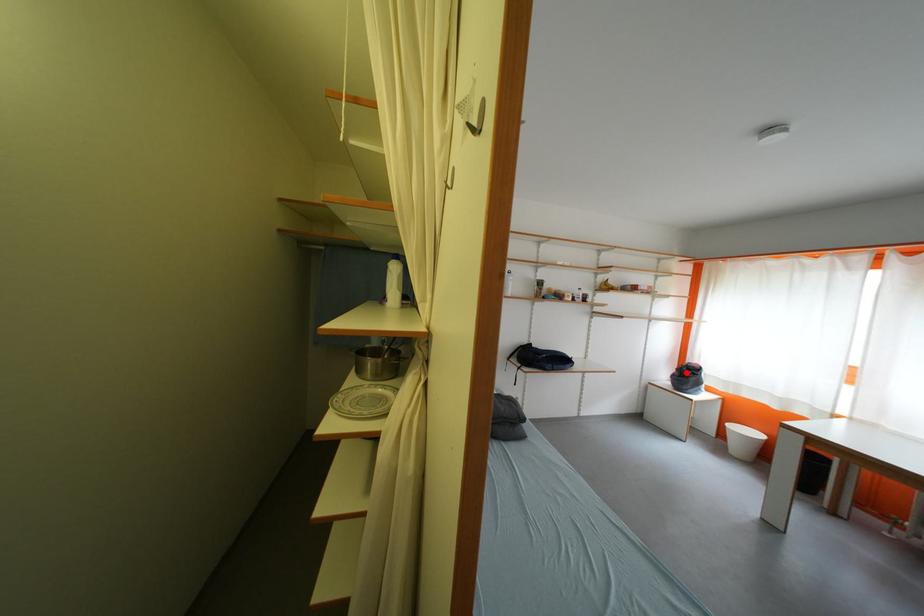
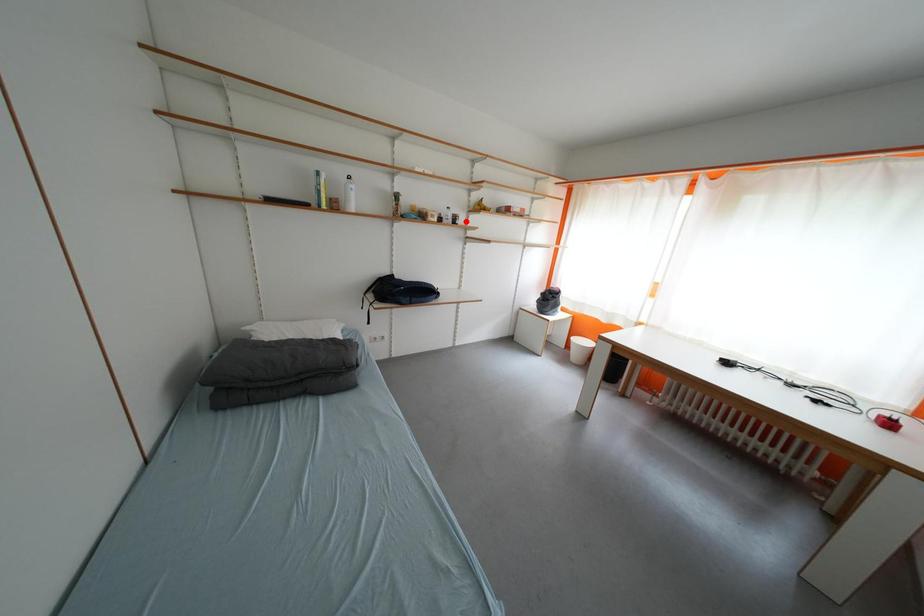
I am providing you with two images of the same scene from different viewpoints. A red point is marked on the first image and another point is marked on the second image. Is the marked point in image1 the same physical position as the marked point in image2?

No